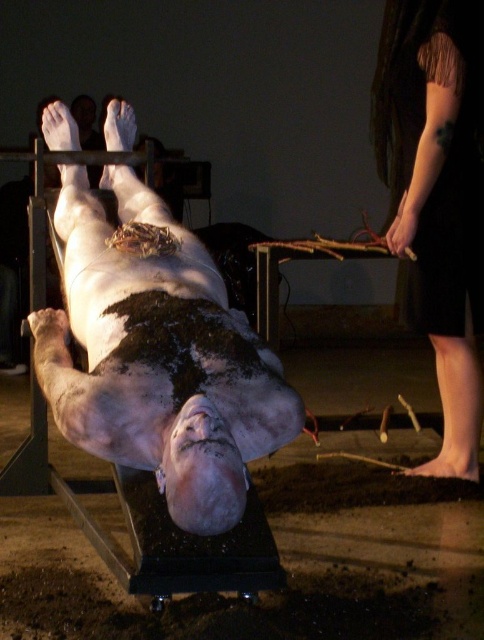
Consider the image. Between white matte human at center and dark fabric dress at right, which one appears on the right side from the viewer's perspective?

From the viewer's perspective, dark fabric dress at right appears more on the right side.

The height and width of the screenshot is (640, 484). What do you see at coordinates (157, 355) in the screenshot?
I see `white matte human at center` at bounding box center [157, 355].

Is point (205, 285) farther from camera compared to point (454, 292)?

No, (205, 285) is in front of (454, 292).

The image size is (484, 640). I want to click on white matte human at center, so (x=157, y=355).